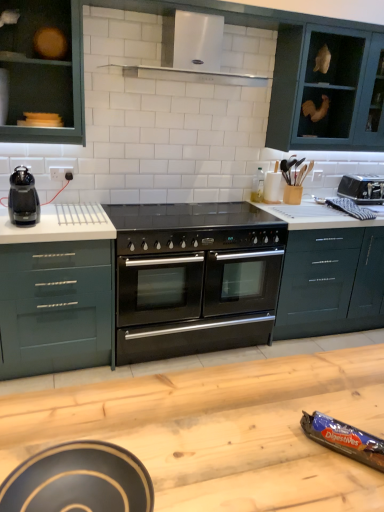
Identify the location of vacant space in between matte black bowl at lower left, arranged as the 1th appliance when viewed from the front, and blue foil digestives at lower right, the 2th appliance from the right. 261,466.